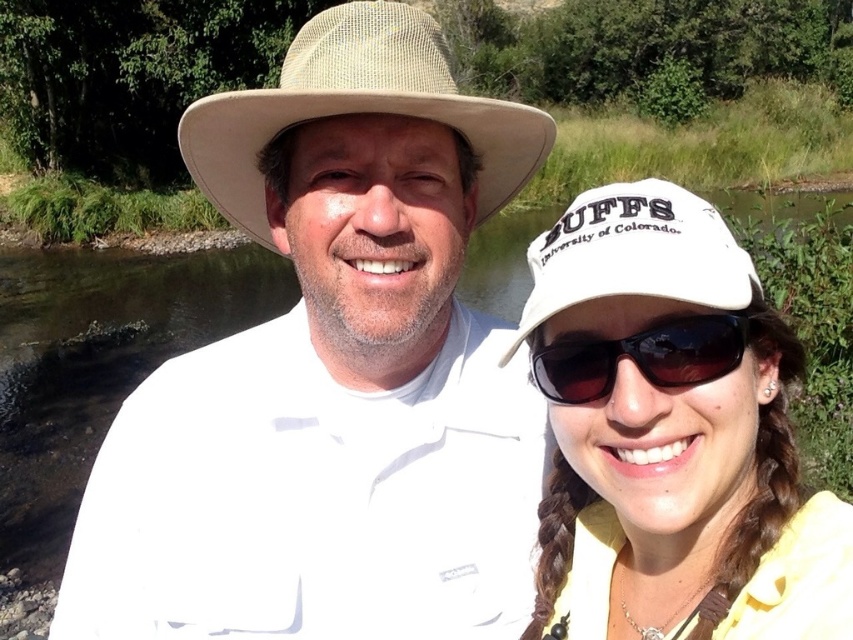
You are a photographer trying to capture a closeup of the clear water at creek center. However, the black reflective sunglasses at center are blocking your view. Can you move the sunglasses slightly to the left to get a better shot?

The clear water at creek center is further to the viewer than the black reflective sunglasses at center, so moving the sunglasses to the left would allow you to see the clear water at creek center better by removing the obstruction.

You are a photographer trying to capture both the white woven hat at upper center and the white fabric baseball cap at center in a single frame. Given their height difference, which object will appear larger in the photo?

The white woven hat at upper center will appear larger in the photo because it is much taller than the white fabric baseball cap at center.